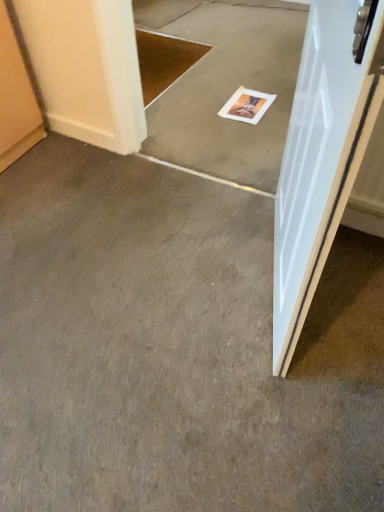
Find the location of a particular element. The height and width of the screenshot is (512, 384). gray carpet at center, the first concrete in the bottom-to-top sequence is located at coordinates (175, 347).

The image size is (384, 512). Describe the element at coordinates (247, 105) in the screenshot. I see `white paper magazine at center` at that location.

I want to click on gray carpet at center, placed as the 2th concrete when sorted from top to bottom, so click(x=175, y=347).

Between white paper magazine at center and smooth gray carpet at center, placed as the second concrete when sorted from bottom to top, which one appears on the left side from the viewer's perspective?

smooth gray carpet at center, placed as the second concrete when sorted from bottom to top, is more to the left.

From a real-world perspective, is white paper magazine at center over smooth gray carpet at center, placed as the second concrete when sorted from bottom to top?

No, from a real-world perspective, white paper magazine at center is not above smooth gray carpet at center, placed as the second concrete when sorted from bottom to top.

Looking at this image, is white paper magazine at center touching smooth gray carpet at center, placed as the second concrete when sorted from bottom to top?

They are not placed beside each other.

From the image's perspective, is gray carpet at center, placed as the 2th concrete when sorted from top to bottom, below smooth gray carpet at center, placed as the second concrete when sorted from bottom to top?

Yes.

Is gray carpet at center, the first concrete in the bottom-to-top sequence, wider or thinner than smooth gray carpet at center, the 1th concrete in the top-to-bottom sequence?

In the image, gray carpet at center, the first concrete in the bottom-to-top sequence, appears to be wider than smooth gray carpet at center, the 1th concrete in the top-to-bottom sequence.

Could you tell me if gray carpet at center, placed as the 2th concrete when sorted from top to bottom, is turned towards smooth gray carpet at center, placed as the second concrete when sorted from bottom to top?

No, gray carpet at center, placed as the 2th concrete when sorted from top to bottom, is not turned towards smooth gray carpet at center, placed as the second concrete when sorted from bottom to top.

From a real-world perspective, who is located higher, gray carpet at center, placed as the 2th concrete when sorted from top to bottom, or smooth gray carpet at center, the 1th concrete in the top-to-bottom sequence?

smooth gray carpet at center, the 1th concrete in the top-to-bottom sequence, is physically above.

Would you say smooth gray carpet at center, placed as the second concrete when sorted from bottom to top, is inside or outside white glossy door at right?

smooth gray carpet at center, placed as the second concrete when sorted from bottom to top, is located beyond the bounds of white glossy door at right.

Find the location of a particular element. The height and width of the screenshot is (512, 384). concrete that is the 1st object to the left of the white glossy door at right, starting at the anchor is located at coordinates (225, 85).

Considering the positions of point (162, 133) and point (287, 267), is point (162, 133) closer or farther from the camera than point (287, 267)?

Point (162, 133) is farther from the camera than point (287, 267).

Are smooth gray carpet at center, placed as the second concrete when sorted from bottom to top, and white glossy door at right beside each other?

No, smooth gray carpet at center, placed as the second concrete when sorted from bottom to top, is not touching white glossy door at right.

Which is more to the right, white paper magazine at center or gray carpet at center, placed as the 2th concrete when sorted from top to bottom?

white paper magazine at center.

Considering their positions, is white paper magazine at center located in front of or behind gray carpet at center, the first concrete in the bottom-to-top sequence?

white paper magazine at center is behind gray carpet at center, the first concrete in the bottom-to-top sequence.

From a real-world perspective, which is physically above, white paper magazine at center or gray carpet at center, the first concrete in the bottom-to-top sequence?

white paper magazine at center is physically above.

In the scene shown: Considering their positions, is gray carpet at center, the first concrete in the bottom-to-top sequence, located in front of or behind white glossy door at right?

In the image, gray carpet at center, the first concrete in the bottom-to-top sequence, appears behind white glossy door at right.

Does gray carpet at center, the first concrete in the bottom-to-top sequence, turn towards white glossy door at right?

No, gray carpet at center, the first concrete in the bottom-to-top sequence, is not aimed at white glossy door at right.

Does gray carpet at center, the first concrete in the bottom-to-top sequence, have a lesser width compared to white glossy door at right?

No.

Does gray carpet at center, placed as the 2th concrete when sorted from top to bottom, have a greater width compared to white paper magazine at center?

Correct, the width of gray carpet at center, placed as the 2th concrete when sorted from top to bottom, exceeds that of white paper magazine at center.

Would you consider gray carpet at center, the first concrete in the bottom-to-top sequence, to be distant from white paper magazine at center?

Yes, gray carpet at center, the first concrete in the bottom-to-top sequence, is far from white paper magazine at center.

From a real-world perspective, between gray carpet at center, the first concrete in the bottom-to-top sequence, and white paper magazine at center, who is vertically higher?

white paper magazine at center is physically above.

Relative to white paper magazine at center, is gray carpet at center, placed as the 2th concrete when sorted from top to bottom, in front or behind?

Clearly, gray carpet at center, placed as the 2th concrete when sorted from top to bottom, is in front of white paper magazine at center.

From the image's perspective, is white glossy door at right located beneath white paper magazine at center?

Yes.

Based on the photo, from a real-world perspective, relative to white paper magazine at center, is white glossy door at right vertically above or below?

white glossy door at right is above white paper magazine at center.

Could you tell me if white glossy door at right is turned towards white paper magazine at center?

No.

Which of these two, white glossy door at right or white paper magazine at center, is wider?

With larger width is white paper magazine at center.

Where is `magazine that is above the smooth gray carpet at center, the 1th concrete in the top-to-bottom sequence (from the image's perspective)`? magazine that is above the smooth gray carpet at center, the 1th concrete in the top-to-bottom sequence (from the image's perspective) is located at coordinates (247, 105).

Identify the location of concrete that appears behind the gray carpet at center, placed as the 2th concrete when sorted from top to bottom. point(225,85).

Considering their positions, is gray carpet at center, the first concrete in the bottom-to-top sequence, positioned closer to white glossy door at right than white paper magazine at center?

gray carpet at center, the first concrete in the bottom-to-top sequence, is closer to white glossy door at right.

Looking at the image, which one is located closer to smooth gray carpet at center, placed as the second concrete when sorted from bottom to top, white paper magazine at center or white glossy door at right?

The object closer to smooth gray carpet at center, placed as the second concrete when sorted from bottom to top, is white paper magazine at center.

Which object lies nearer to the anchor point white paper magazine at center, smooth gray carpet at center, placed as the second concrete when sorted from bottom to top, or white glossy door at right?

The object closer to white paper magazine at center is smooth gray carpet at center, placed as the second concrete when sorted from bottom to top.

Which object lies nearer to the anchor point gray carpet at center, placed as the 2th concrete when sorted from top to bottom, white glossy door at right or smooth gray carpet at center, the 1th concrete in the top-to-bottom sequence?

white glossy door at right is positioned closer to the anchor gray carpet at center, placed as the 2th concrete when sorted from top to bottom.

From the image, which object appears to be nearer to gray carpet at center, placed as the 2th concrete when sorted from top to bottom, white paper magazine at center or white glossy door at right?

Based on the image, white glossy door at right appears to be nearer to gray carpet at center, placed as the 2th concrete when sorted from top to bottom.

From the image, which object appears to be nearer to smooth gray carpet at center, the 1th concrete in the top-to-bottom sequence, white paper magazine at center or gray carpet at center, the first concrete in the bottom-to-top sequence?

white paper magazine at center.

Based on the photo, looking at the image, which one is located further to gray carpet at center, the first concrete in the bottom-to-top sequence, white paper magazine at center or smooth gray carpet at center, placed as the second concrete when sorted from bottom to top?

white paper magazine at center is positioned further to the anchor gray carpet at center, the first concrete in the bottom-to-top sequence.

Considering their positions, is smooth gray carpet at center, the 1th concrete in the top-to-bottom sequence, positioned closer to gray carpet at center, placed as the 2th concrete when sorted from top to bottom, than white glossy door at right?

white glossy door at right is positioned closer to the anchor gray carpet at center, placed as the 2th concrete when sorted from top to bottom.

You are a GUI agent. You are given a task and a screenshot of the screen. Output one action in this format:
    pyautogui.click(x=<x>, y=<y>)
    Task: Click on the door between smooth gray carpet at center, placed as the second concrete when sorted from bottom to top, and gray carpet at center, the first concrete in the bottom-to-top sequence, in the up-down direction
    
    Given the screenshot: What is the action you would take?
    pyautogui.click(x=322, y=153)

I want to click on concrete located between gray carpet at center, the first concrete in the bottom-to-top sequence, and white paper magazine at center in the depth direction, so click(225, 85).